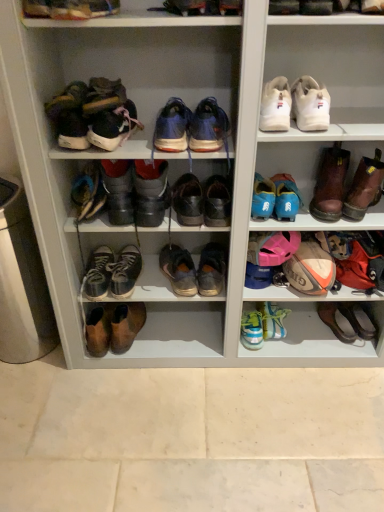
Find the location of a particular element. The image size is (384, 512). vacant space to the left of light blue synthetic sneakers at lower center, arranged as the 3th shoe when viewed from the right is located at coordinates point(205,336).